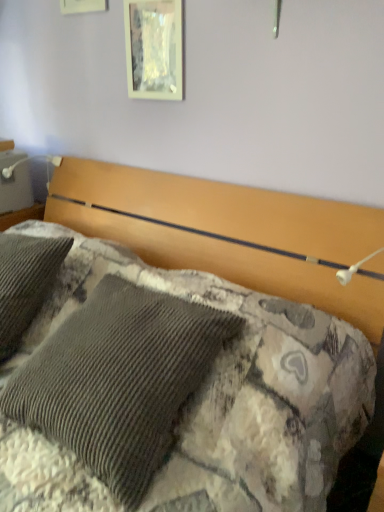
Question: Do you think corduroy fabric bed at center is within metallic glass picture frame at upper center, or outside of it?

Choices:
 (A) outside
 (B) inside

Answer: (A)

Question: From the image's perspective, is corduroy fabric bed at center above or below metallic glass picture frame at upper center?

Choices:
 (A) below
 (B) above

Answer: (A)

Question: Relative to metallic glass picture frame at upper center, is corduroy fabric bed at center in front or behind?

Choices:
 (A) front
 (B) behind

Answer: (A)

Question: Considering the positions of metallic glass picture frame at upper center and corduroy fabric bed at center in the image, is metallic glass picture frame at upper center bigger or smaller than corduroy fabric bed at center?

Choices:
 (A) small
 (B) big

Answer: (A)

Question: Considering their positions, is metallic glass picture frame at upper center located in front of or behind corduroy fabric bed at center?

Choices:
 (A) behind
 (B) front

Answer: (A)

Question: In terms of width, does metallic glass picture frame at upper center look wider or thinner when compared to corduroy fabric bed at center?

Choices:
 (A) wide
 (B) thin

Answer: (B)

Question: Considering the positions of point (130, 72) and point (362, 216), is point (130, 72) closer or farther from the camera than point (362, 216)?

Choices:
 (A) closer
 (B) farther

Answer: (B)